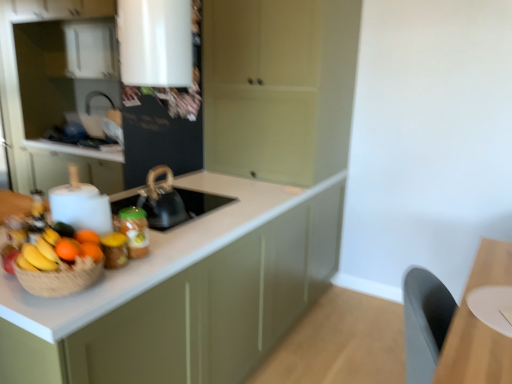
Locate an element on the screen. The width and height of the screenshot is (512, 384). vacant area that is situated to the right of black matte kettle at center is located at coordinates (209, 221).